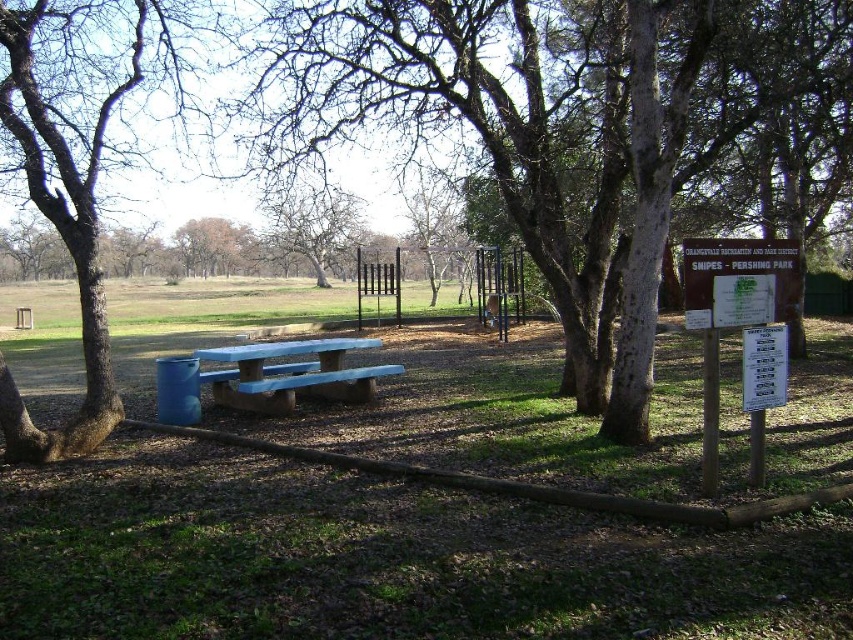
Based on the photo, who is lower down, bare wood tree at center or brown rough tree at upper center?

bare wood tree at center is below.

Does bare wood tree at center appear on the right side of brown rough tree at upper center?

Indeed, bare wood tree at center is positioned on the right side of brown rough tree at upper center.

Between point (332, 195) and point (195, 221), which one is positioned in front?

Point (332, 195) is more forward.

Locate an element on the screen. Image resolution: width=853 pixels, height=640 pixels. bare wood tree at center is located at coordinates (311, 221).

Between green paper sign at right and brown rough tree at upper center, which one has less height?

green paper sign at right is shorter.

Is point (711, 273) positioned in front of point (245, 250)?

Yes, point (711, 273) is closer to viewer.

The width and height of the screenshot is (853, 640). In order to click on green paper sign at right in this screenshot , I will do `click(740, 268)`.

Who is more forward, (756, 257) or (430, 285)?

Point (756, 257) is more forward.

Can you confirm if green paper sign at right is taller than bare branches at center?

No, green paper sign at right is not taller than bare branches at center.

Which is in front, point (697, 296) or point (445, 209)?

Point (697, 296) is more forward.

I want to click on green paper sign at right, so click(740, 268).